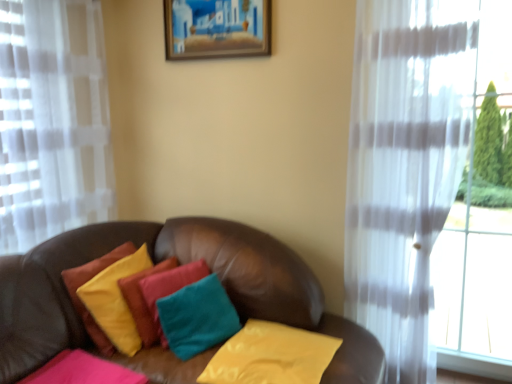
Question: Is pink velvety pillow at lower left, the first pillow from the left, positioned in front of wooden picture frame at upper center?

Choices:
 (A) no
 (B) yes

Answer: (B)

Question: Is pink velvety pillow at lower left, the first pillow from the left, at the right side of wooden picture frame at upper center?

Choices:
 (A) no
 (B) yes

Answer: (A)

Question: Considering the relative sizes of pink velvety pillow at lower left, acting as the 4th pillow starting from the right, and wooden picture frame at upper center in the image provided, is pink velvety pillow at lower left, acting as the 4th pillow starting from the right, thinner than wooden picture frame at upper center?

Choices:
 (A) yes
 (B) no

Answer: (B)

Question: From the image's perspective, is pink velvety pillow at lower left, the first pillow from the left, located beneath wooden picture frame at upper center?

Choices:
 (A) yes
 (B) no

Answer: (A)

Question: Could wooden picture frame at upper center be considered to be inside pink velvety pillow at lower left, the first pillow from the left?

Choices:
 (A) no
 (B) yes

Answer: (A)

Question: Is teal fabric pillow at center, the 2th pillow from the right, inside the boundaries of yellow fabric pillow at center, the 4th pillow positioned from the left, or outside?

Choices:
 (A) outside
 (B) inside

Answer: (A)

Question: Is teal fabric pillow at center, the 2th pillow from the right, in front of or behind yellow fabric pillow at center, the 4th pillow positioned from the left, in the image?

Choices:
 (A) behind
 (B) front

Answer: (A)

Question: In terms of width, does teal fabric pillow at center, the 2th pillow from the right, look wider or thinner when compared to yellow fabric pillow at center, which is the first pillow in right-to-left order?

Choices:
 (A) thin
 (B) wide

Answer: (A)

Question: From a real-world perspective, is teal fabric pillow at center, which is the 3th pillow in left-to-right order, physically located above or below yellow fabric pillow at center, which is the first pillow in right-to-left order?

Choices:
 (A) above
 (B) below

Answer: (A)

Question: In terms of width, does pink velvety pillow at lower left, acting as the 4th pillow starting from the right, look wider or thinner when compared to yellow fabric pillow at center, the 4th pillow positioned from the left?

Choices:
 (A) wide
 (B) thin

Answer: (B)

Question: Relative to yellow fabric pillow at center, which is the first pillow in right-to-left order, is pink velvety pillow at lower left, acting as the 4th pillow starting from the right, in front or behind?

Choices:
 (A) behind
 (B) front

Answer: (B)

Question: Would you say pink velvety pillow at lower left, acting as the 4th pillow starting from the right, is to the left or to the right of yellow fabric pillow at center, which is the first pillow in right-to-left order, in the picture?

Choices:
 (A) right
 (B) left

Answer: (B)

Question: From a real-world perspective, relative to yellow fabric pillow at center, which is the first pillow in right-to-left order, is pink velvety pillow at lower left, acting as the 4th pillow starting from the right, vertically above or below?

Choices:
 (A) below
 (B) above

Answer: (B)

Question: Is teal fabric pillow at center, which is the 3th pillow in left-to-right order, spatially inside wooden picture frame at upper center, or outside of it?

Choices:
 (A) inside
 (B) outside

Answer: (B)

Question: In the image, is teal fabric pillow at center, which is the 3th pillow in left-to-right order, positioned in front of or behind wooden picture frame at upper center?

Choices:
 (A) behind
 (B) front

Answer: (B)